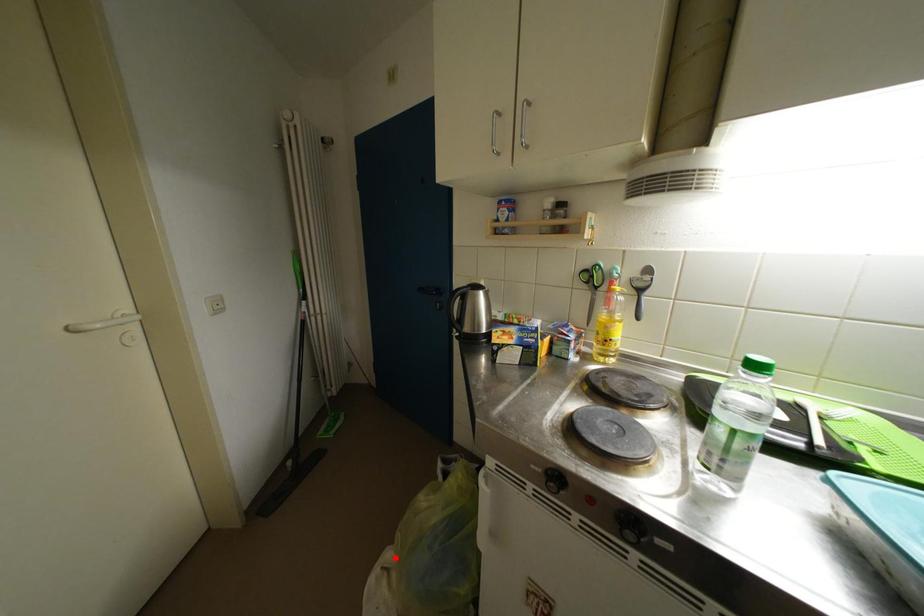
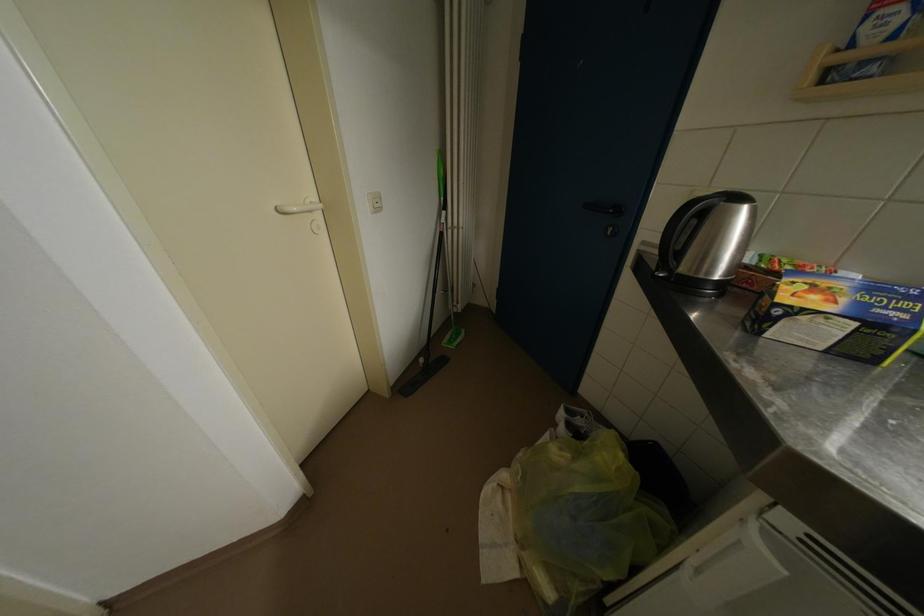
In the second image, find the point that corresponds to the highlighted location in the first image.

(511, 480)